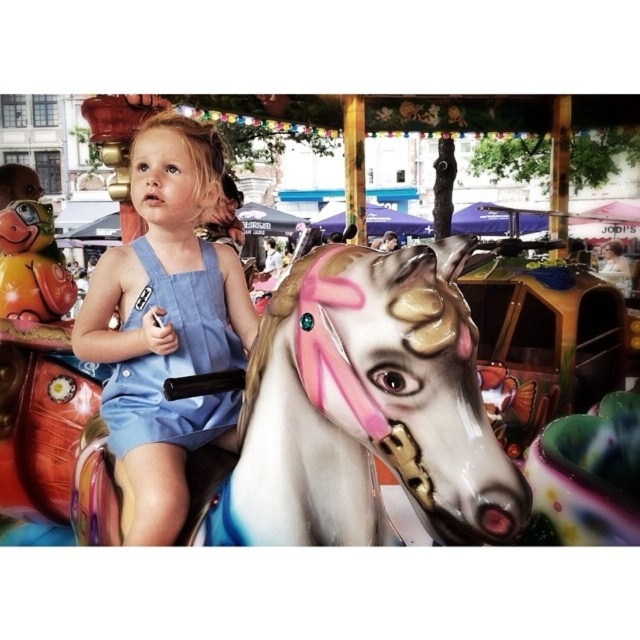
Question: Is shiny metallic carousel horse at center further to the viewer compared to denim overalls at center?

Choices:
 (A) no
 (B) yes

Answer: (A)

Question: Does blue denim dress at center appear over denim overalls at center?

Choices:
 (A) yes
 (B) no

Answer: (A)

Question: Estimate the real-world distances between objects in this image. Which object is closer to the blue denim dress at center?

Choices:
 (A) denim overalls at center
 (B) shiny metallic carousel horse at center

Answer: (A)

Question: Which object appears closest to the camera in this image?

Choices:
 (A) denim overalls at center
 (B) shiny metallic carousel horse at center
 (C) blue denim dress at center

Answer: (B)

Question: Does shiny metallic carousel horse at center appear on the left side of denim overalls at center?

Choices:
 (A) yes
 (B) no

Answer: (B)

Question: Considering the real-world distances, which object is farthest from the blue denim dress at center?

Choices:
 (A) denim overalls at center
 (B) shiny metallic carousel horse at center

Answer: (B)